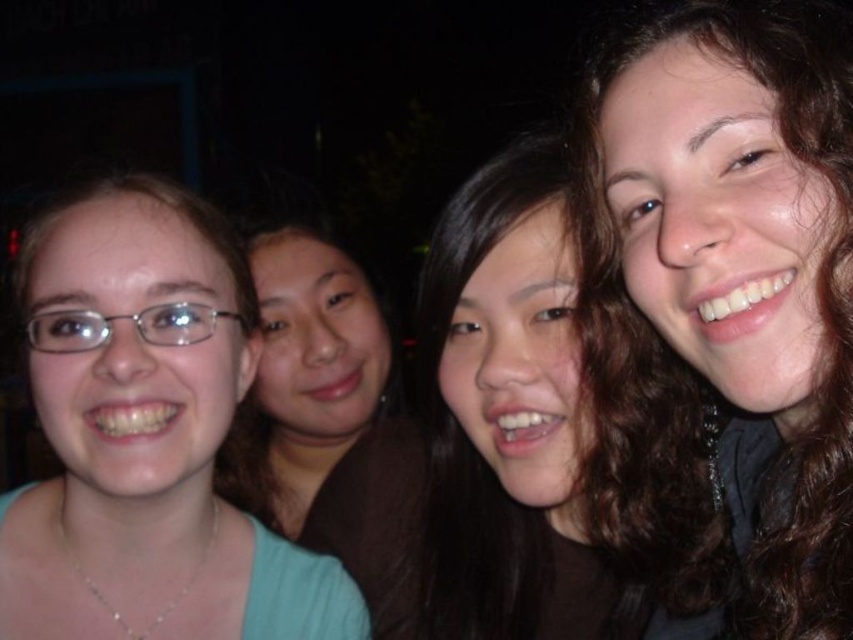
Question: Considering the relative positions of matte teal shirt at left and clear plastic glasses at left in the image provided, where is matte teal shirt at left located with respect to clear plastic glasses at left?

Choices:
 (A) below
 (B) above

Answer: (A)

Question: Considering the real-world distances, which object is closest to the dark brown hair at center?

Choices:
 (A) matte teal shirt at left
 (B) clear plastic glasses at left
 (C) brown curly hair at center

Answer: (C)

Question: Considering the real-world distances, which object is farthest from the dark brown hair at center?

Choices:
 (A) brown curly hair at center
 (B) smooth brown hair at center

Answer: (B)

Question: Is smooth brown hair at center to the right of clear plastic glasses at left from the viewer's perspective?

Choices:
 (A) no
 (B) yes

Answer: (B)

Question: Estimate the real-world distances between objects in this image. Which object is farther from the brown curly hair at center?

Choices:
 (A) dark brown hair at center
 (B) matte teal shirt at left

Answer: (B)

Question: Can you confirm if brown curly hair at center is thinner than clear plastic glasses at left?

Choices:
 (A) yes
 (B) no

Answer: (B)